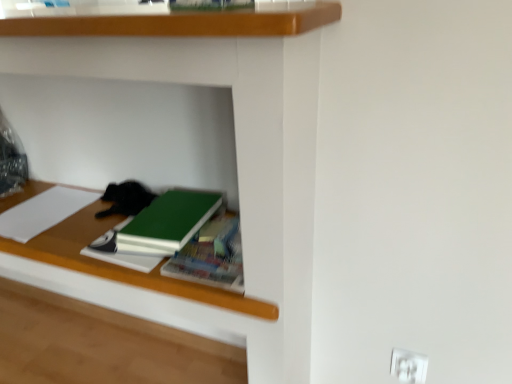
This screenshot has height=384, width=512. What do you see at coordinates (167, 222) in the screenshot? I see `green matte book at center, the 2th book in the right-to-left sequence` at bounding box center [167, 222].

The image size is (512, 384). What do you see at coordinates (126, 199) in the screenshot? I see `black fur cat at center` at bounding box center [126, 199].

Find the location of a particular element. The image size is (512, 384). wooden shelf at center is located at coordinates (234, 133).

Can you confirm if green matte book at center, the 2th book in the right-to-left sequence, is thinner than green matte book at center, which is the first book from right to left?

Yes.

Which is nearer, (206, 191) or (188, 247)?

The point (188, 247) is in front.

Where is `the 1st book above when counting from the green matte book at center, placed as the third book when sorted from left to right (from the image's perspective)`? the 1st book above when counting from the green matte book at center, placed as the third book when sorted from left to right (from the image's perspective) is located at coordinates (167, 222).

From a real-world perspective, between green matte book at center, acting as the 2th book starting from the left, and green matte book at center, which is the first book from right to left, who is vertically higher?

green matte book at center, acting as the 2th book starting from the left, is physically above.

Is green matte book at center, acting as the 2th book starting from the left, with green matte notebook at center?

There is a gap between green matte book at center, acting as the 2th book starting from the left, and green matte notebook at center.

How much distance is there between green matte book at center, the 2th book in the right-to-left sequence, and green matte notebook at center?

The distance of green matte book at center, the 2th book in the right-to-left sequence, from green matte notebook at center is 11.06 centimeters.

Which object is closer to the camera, green matte book at center, the 2th book in the right-to-left sequence, or green matte notebook at center?

green matte book at center, the 2th book in the right-to-left sequence, is more forward.

Is green matte book at center, the 2th book in the right-to-left sequence, aimed at green matte notebook at center?

No.

What's the angular difference between white plastic electric outlet at lower right and white paper at left, the third book positioned from the right,'s facing directions?

The facing directions of white plastic electric outlet at lower right and white paper at left, the third book positioned from the right, are 2.52 degrees apart.

Is the surface of white plastic electric outlet at lower right in direct contact with white paper at left, the third book positioned from the right?

No, white plastic electric outlet at lower right is not making contact with white paper at left, the third book positioned from the right.

From the picture: Considering the relative sizes of white plastic electric outlet at lower right and white paper at left, the third book positioned from the right, in the image provided, is white plastic electric outlet at lower right thinner than white paper at left, the third book positioned from the right,?

Correct, the width of white plastic electric outlet at lower right is less than that of white paper at left, the third book positioned from the right.

From a real-world perspective, is white plastic electric outlet at lower right physically located above or below white paper at left, the first book viewed from the left?

white plastic electric outlet at lower right is below white paper at left, the first book viewed from the left.

Which is farther from the camera, (136, 189) or (190, 194)?

The point (136, 189) is farther from the camera.

Consider the image. Considering the sizes of objects black fur cat at center and green matte book at center, acting as the 2th book starting from the left, in the image provided, who is thinner, black fur cat at center or green matte book at center, acting as the 2th book starting from the left,?

Thinner between the two is black fur cat at center.

From a real-world perspective, is black fur cat at center above or below green matte book at center, the 2th book in the right-to-left sequence?

Clearly, from a real-world perspective, black fur cat at center is below green matte book at center, the 2th book in the right-to-left sequence.

Does black fur cat at center come in front of green matte book at center, acting as the 2th book starting from the left?

No, black fur cat at center is further to the viewer.

Is green matte book at center, acting as the 2th book starting from the left, not inside white paper at left, the third book positioned from the right?

Absolutely, green matte book at center, acting as the 2th book starting from the left, is external to white paper at left, the third book positioned from the right.

Is point (164, 242) less distant than point (10, 223)?

Yes, point (164, 242) is closer to viewer.

Between green matte book at center, acting as the 2th book starting from the left, and white paper at left, the first book viewed from the left, which one appears on the left side from the viewer's perspective?

Positioned to the left is white paper at left, the first book viewed from the left.

Based on the photo, considering the positions of objects green matte book at center, acting as the 2th book starting from the left, and white paper at left, the third book positioned from the right, in the image provided, who is in front, green matte book at center, acting as the 2th book starting from the left, or white paper at left, the third book positioned from the right,?

Positioned in front is green matte book at center, acting as the 2th book starting from the left.

Can you confirm if white paper at left, the first book viewed from the left, is smaller than green matte notebook at center?

Actually, white paper at left, the first book viewed from the left, might be larger than green matte notebook at center.

Is white paper at left, the first book viewed from the left, to the left or to the right of green matte notebook at center in the image?

white paper at left, the first book viewed from the left, is to the left of green matte notebook at center.

From the image's perspective, is white paper at left, the first book viewed from the left, over green matte notebook at center?

Indeed, from the image's perspective, white paper at left, the first book viewed from the left, is shown above green matte notebook at center.

Considering their positions, is white paper at left, the first book viewed from the left, located in front of or behind green matte notebook at center?

Clearly, white paper at left, the first book viewed from the left, is behind green matte notebook at center.

Is wooden shelf at center inside the boundaries of white plastic electric outlet at lower right, or outside?

wooden shelf at center cannot be found inside white plastic electric outlet at lower right.

From a real-world perspective, is wooden shelf at center physically above white plastic electric outlet at lower right?

Indeed, from a real-world perspective, wooden shelf at center stands above white plastic electric outlet at lower right.

Considering the relative positions of wooden shelf at center and white plastic electric outlet at lower right in the image provided, is wooden shelf at center in front of white plastic electric outlet at lower right?

Yes, wooden shelf at center is in front of white plastic electric outlet at lower right.

Is wooden shelf at center facing towards white plastic electric outlet at lower right?

No, wooden shelf at center is not turned towards white plastic electric outlet at lower right.

Find the location of a particular element. the 1st book behind the green matte book at center, which is the first book from right to left is located at coordinates (167, 222).

Locate an element on the screen. This screenshot has width=512, height=384. the 1st book in front of the green matte notebook at center, counting from the anchor's position is located at coordinates (167, 222).

When comparing their distances from white paper at left, the third book positioned from the right, does wooden shelf at center or green matte book at center, placed as the third book when sorted from left to right, seem further?

green matte book at center, placed as the third book when sorted from left to right, is positioned further to the anchor white paper at left, the third book positioned from the right.

When comparing their distances from black fur cat at center, does white paper at left, the first book viewed from the left, or green matte notebook at center seem closer?

white paper at left, the first book viewed from the left, is positioned closer to the anchor black fur cat at center.

Looking at the image, which one is located closer to green matte notebook at center, black fur cat at center or white paper at left, the third book positioned from the right?

black fur cat at center lies closer to green matte notebook at center than the other object.

Looking at the image, which one is located further to wooden shelf at center, green matte book at center, acting as the 2th book starting from the left, or green matte notebook at center?

The object further to wooden shelf at center is green matte notebook at center.

In the scene shown: Considering their positions, is white paper at left, the first book viewed from the left, positioned further to black fur cat at center than green matte book at center, acting as the 2th book starting from the left?

green matte book at center, acting as the 2th book starting from the left, lies further to black fur cat at center than the other object.

From the image, which object appears to be farther from white paper at left, the first book viewed from the left, white plastic electric outlet at lower right or wooden shelf at center?

white plastic electric outlet at lower right is positioned further to the anchor white paper at left, the first book viewed from the left.

From the image, which object appears to be farther from white plastic electric outlet at lower right, black fur cat at center or wooden shelf at center?

Based on the image, black fur cat at center appears to be further to white plastic electric outlet at lower right.

From the image, which object appears to be nearer to green matte book at center, acting as the 2th book starting from the left, green matte book at center, which is the first book from right to left, or white plastic electric outlet at lower right?

green matte book at center, which is the first book from right to left, is positioned closer to the anchor green matte book at center, acting as the 2th book starting from the left.

Find the location of `notebook between white paper at left, the first book viewed from the left, and green matte book at center, which is the first book from right to left, from left to right`. notebook between white paper at left, the first book viewed from the left, and green matte book at center, which is the first book from right to left, from left to right is located at coordinates (125, 259).

Locate an element on the screen. notebook between black fur cat at center and green matte book at center, which is the first book from right to left, from left to right is located at coordinates (125, 259).

Identify the location of cat between white paper at left, the third book positioned from the right, and green matte notebook at center, in the horizontal direction. (126, 199).

You are a GUI agent. You are given a task and a screenshot of the screen. Output one action in this format:
    pyautogui.click(x=<x>, y=<y>)
    Task: Click on the notebook between black fur cat at center and white plastic electric outlet at lower right from left to right
    
    Given the screenshot: What is the action you would take?
    pyautogui.click(x=125, y=259)